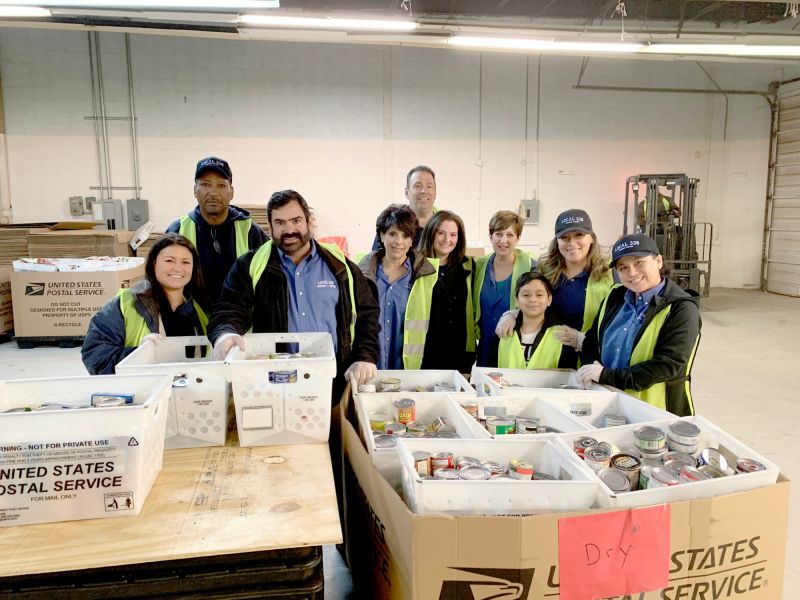
You are a GUI agent. You are given a task and a screenshot of the screen. Output one action in this format:
    pyautogui.click(x=<x>, y=<y>)
    Task: Click on the united states postal service cardboard box
    This screenshot has height=600, width=800.
    Given the screenshot: What is the action you would take?
    pyautogui.click(x=53, y=304), pyautogui.click(x=746, y=527)